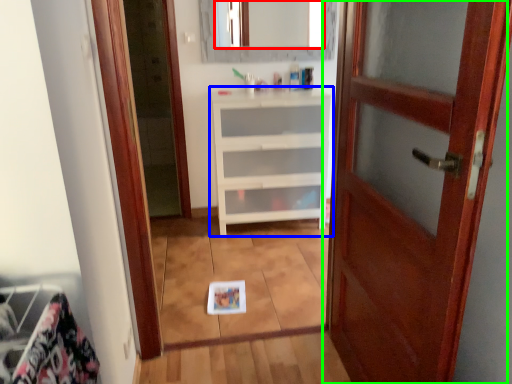
Question: Which object is positioned farthest from mirror (highlighted by a red box)? Select from chest of drawers (highlighted by a blue box) and door (highlighted by a green box).

Choices:
 (A) chest of drawers
 (B) door

Answer: (B)